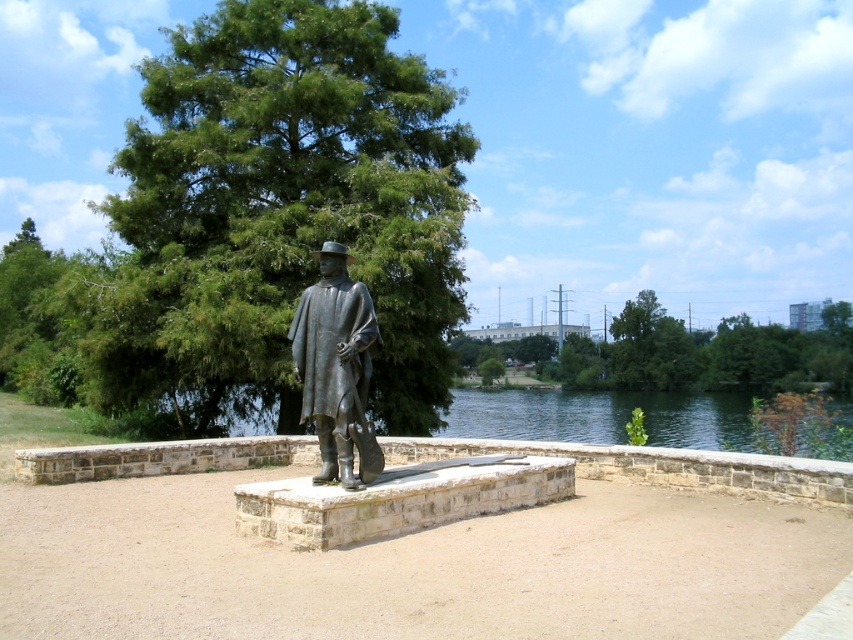
Which is more to the left, green leafy tree at upper center or bronze statue at center?

Positioned to the left is bronze statue at center.

Does green leafy tree at upper center have a lesser width compared to bronze statue at center?

Incorrect, green leafy tree at upper center's width is not less than bronze statue at center's.

Which is behind, point (827, 388) or point (341, 296)?

Point (827, 388)

I want to click on green leafy tree at upper center, so click(x=705, y=353).

Is point (212, 259) more distant than point (805, 358)?

That is False.

Measure the distance from green leafy tree at center to green leafy tree at upper center.

The distance of green leafy tree at center from green leafy tree at upper center is 22.43 meters.

The image size is (853, 640). Describe the element at coordinates (283, 209) in the screenshot. I see `green leafy tree at center` at that location.

You are a GUI agent. You are given a task and a screenshot of the screen. Output one action in this format:
    pyautogui.click(x=<x>, y=<y>)
    Task: Click on the green leafy tree at center
    The height and width of the screenshot is (640, 853).
    Given the screenshot: What is the action you would take?
    pyautogui.click(x=283, y=209)

Which is in front, point (111, 352) or point (315, 291)?

Point (315, 291) is in front.

Is green leafy tree at center positioned before bronze statue at center?

No, it is behind bronze statue at center.

Is point (195, 147) positioned in front of point (352, 486)?

No, (195, 147) is further to viewer.

Find the location of a particular element. The image size is (853, 640). green leafy tree at center is located at coordinates click(x=283, y=209).